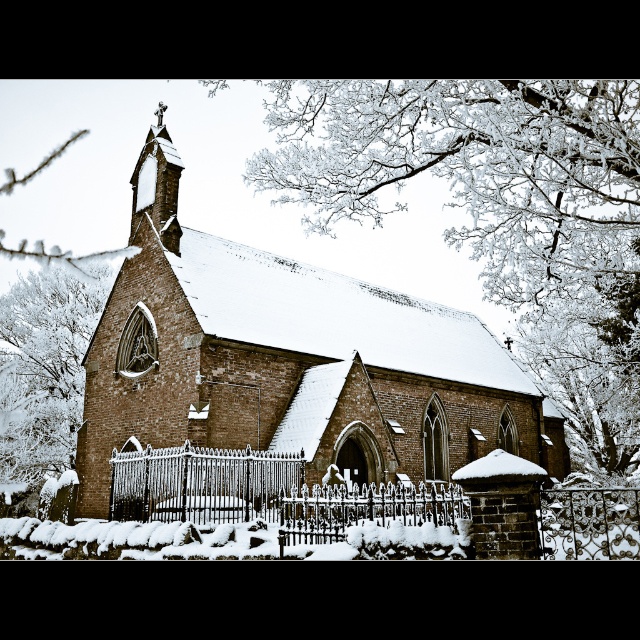
Question: Can you confirm if brown brick church at center is positioned to the left of silver wrought iron fence at center?

Choices:
 (A) no
 (B) yes

Answer: (A)

Question: Which object appears farthest from the camera in this image?

Choices:
 (A) brown brick church at center
 (B) silver wrought iron fence at center
 (C) black wrought iron fence at center
 (D) white frosty branches at left

Answer: (D)

Question: Where is brown brick church at center located in relation to silver wrought iron fence at center in the image?

Choices:
 (A) right
 (B) left

Answer: (A)

Question: Which point appears farthest from the camera in this image?

Choices:
 (A) (253, 490)
 (B) (540, 461)

Answer: (B)

Question: Which of the following is the farthest from the observer?

Choices:
 (A) (232, 477)
 (B) (17, 298)
 (C) (132, 390)
 (D) (196, 472)

Answer: (B)

Question: Can you confirm if silver wrought iron fence at center is smaller than black wrought iron fence at center?

Choices:
 (A) yes
 (B) no

Answer: (B)